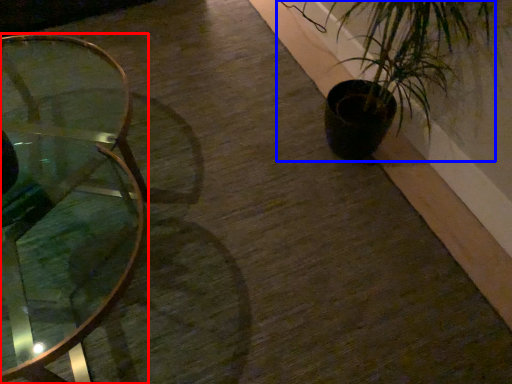
Question: Which object is closer to the camera taking this photo, table (highlighted by a red box) or houseplant (highlighted by a blue box)?

Choices:
 (A) table
 (B) houseplant

Answer: (A)